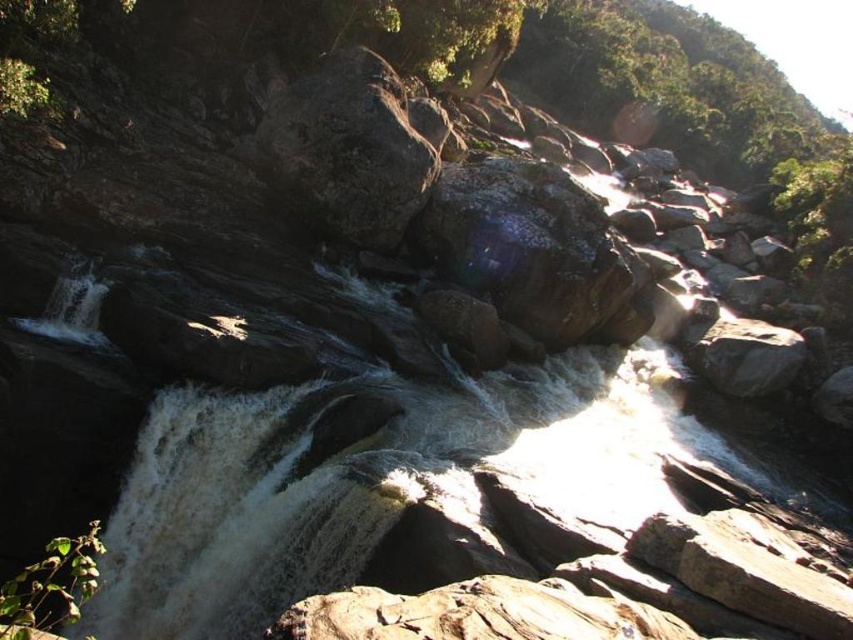
Question: Among these points, which one is farthest from the camera?

Choices:
 (A) (358, 65)
 (B) (598, 305)

Answer: (A)

Question: Among these objects, which one is nearest to the camera?

Choices:
 (A) glossy dark rock at center
 (B) rough stone boulder at center

Answer: (B)

Question: Which object is farther from the camera taking this photo?

Choices:
 (A) glossy dark rock at center
 (B) rough stone boulder at center

Answer: (A)

Question: Is the position of glossy dark rock at center less distant than that of rough stone boulder at center?

Choices:
 (A) no
 (B) yes

Answer: (A)

Question: Does glossy dark rock at center have a greater width compared to rough stone boulder at center?

Choices:
 (A) yes
 (B) no

Answer: (A)

Question: Does glossy dark rock at center lie behind rough stone boulder at center?

Choices:
 (A) yes
 (B) no

Answer: (A)